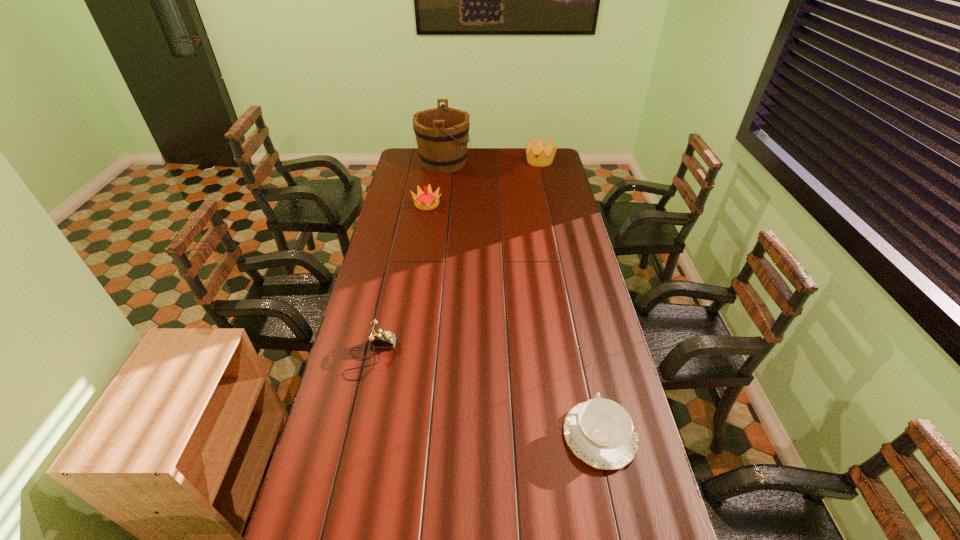
The height and width of the screenshot is (540, 960). In order to click on vacant space located on the handle side of the chinaware in this screenshot , I will do `click(579, 336)`.

Image resolution: width=960 pixels, height=540 pixels. I want to click on vacant space located on the handle side of the chinaware, so 585,367.

You are a GUI agent. You are given a task and a screenshot of the screen. Output one action in this format:
    pyautogui.click(x=<x>, y=<y>)
    Task: Click on the free region located 0.050m on the handle side of the chinaware
    Image resolution: width=960 pixels, height=540 pixels.
    Given the screenshot: What is the action you would take?
    pyautogui.click(x=590, y=390)

You are a GUI agent. You are given a task and a screenshot of the screen. Output one action in this format:
    pyautogui.click(x=<x>, y=<y>)
    Task: Click on the wine bucket present at the far edge
    
    Given the screenshot: What is the action you would take?
    pyautogui.click(x=441, y=133)

This screenshot has width=960, height=540. I want to click on crown that is at the far edge, so click(x=546, y=153).

At what (x,y) coordinates should I click in order to perform the action: click on wine bucket at the left edge. Please return your answer as a coordinate pair (x, y). The height and width of the screenshot is (540, 960). Looking at the image, I should click on tap(441, 133).

You are a GUI agent. You are given a task and a screenshot of the screen. Output one action in this format:
    pyautogui.click(x=<x>, y=<y>)
    Task: Click on the crown located at the left edge
    This screenshot has height=540, width=960.
    Given the screenshot: What is the action you would take?
    pyautogui.click(x=427, y=200)

The image size is (960, 540). What are the coordinates of `telephone present at the left edge` in the screenshot? It's located at (379, 338).

At what (x,y) coordinates should I click in order to perform the action: click on crown that is at the right edge. Please return your answer as a coordinate pair (x, y). This screenshot has height=540, width=960. Looking at the image, I should click on (546, 153).

What are the coordinates of `chinaware positioned at the right edge` in the screenshot? It's located at (599, 432).